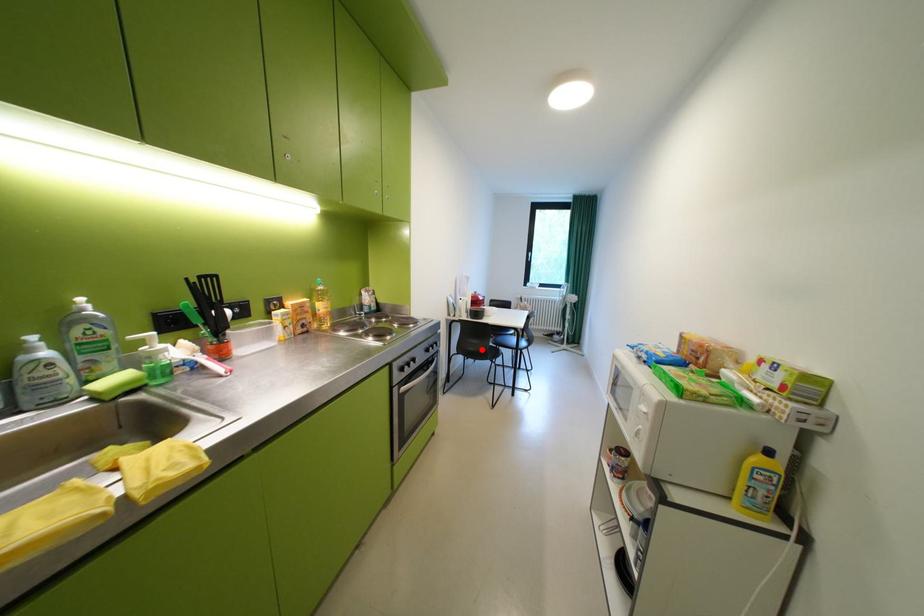
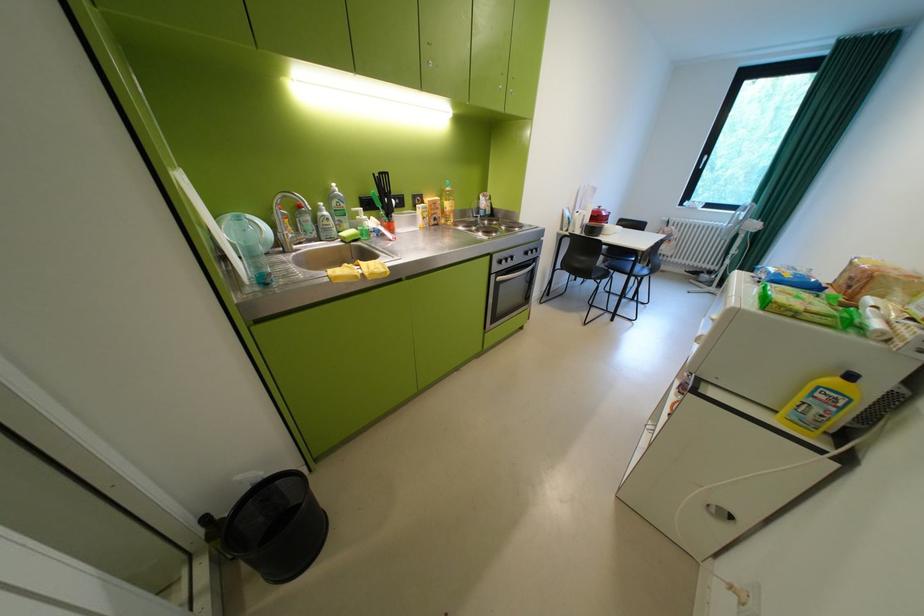
Where in the second image is the point corresponding to the highlighted location from the first image?

(587, 265)